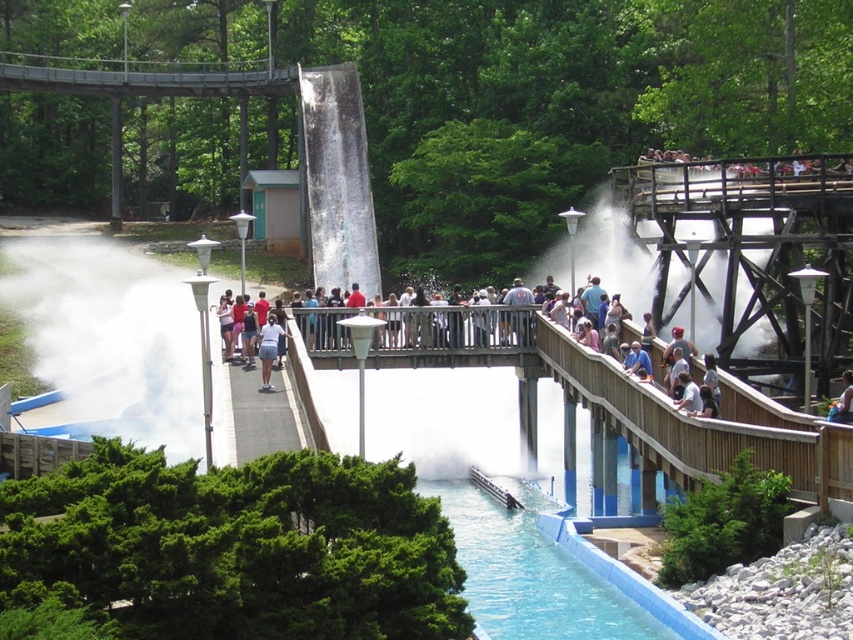
Question: Does white cotton shirt at center appear on the right side of blue denim shorts at upper center?

Choices:
 (A) no
 (B) yes

Answer: (A)

Question: Which object is the farthest from the blue denim shorts at upper center?

Choices:
 (A) white cotton shirt at center
 (B) white mist at center

Answer: (B)

Question: Is white mist at center positioned in front of white matte water at upper center?

Choices:
 (A) no
 (B) yes

Answer: (B)

Question: Which point is farther to the camera?

Choices:
 (A) blue denim shorts at upper center
 (B) white matte water at upper center
 (C) white cotton shirt at center

Answer: (B)

Question: Does white mist at center have a greater width compared to blue denim shorts at upper center?

Choices:
 (A) no
 (B) yes

Answer: (B)

Question: Which point is closer to the camera taking this photo?

Choices:
 (A) (262, 328)
 (B) (125, 371)
 (C) (618, 227)
 (D) (842, 417)

Answer: (D)